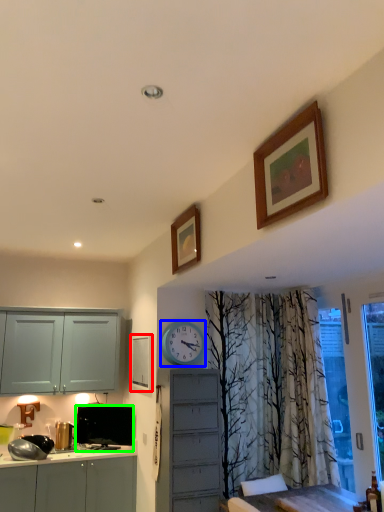
Question: Estimate the real-world distances between objects in this image. Which object is closer to picture frame (highlighted by a red box), clock (highlighted by a blue box) or television (highlighted by a green box)?

Choices:
 (A) clock
 (B) television

Answer: (A)